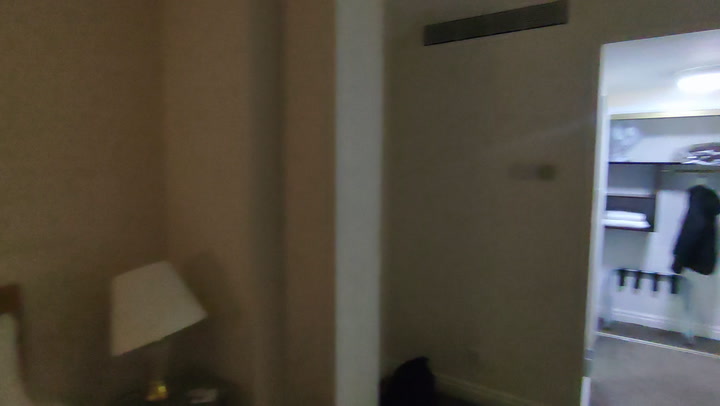
Locate an element on the screen. The height and width of the screenshot is (406, 720). shoe rack is located at coordinates (608, 280).